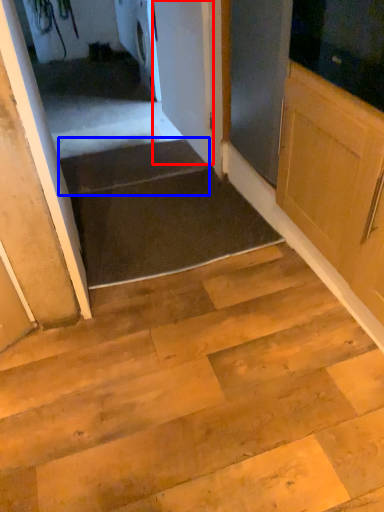
Question: Which object is closer to the camera taking this photo, door (highlighted by a red box) or stairs (highlighted by a blue box)?

Choices:
 (A) door
 (B) stairs

Answer: (A)